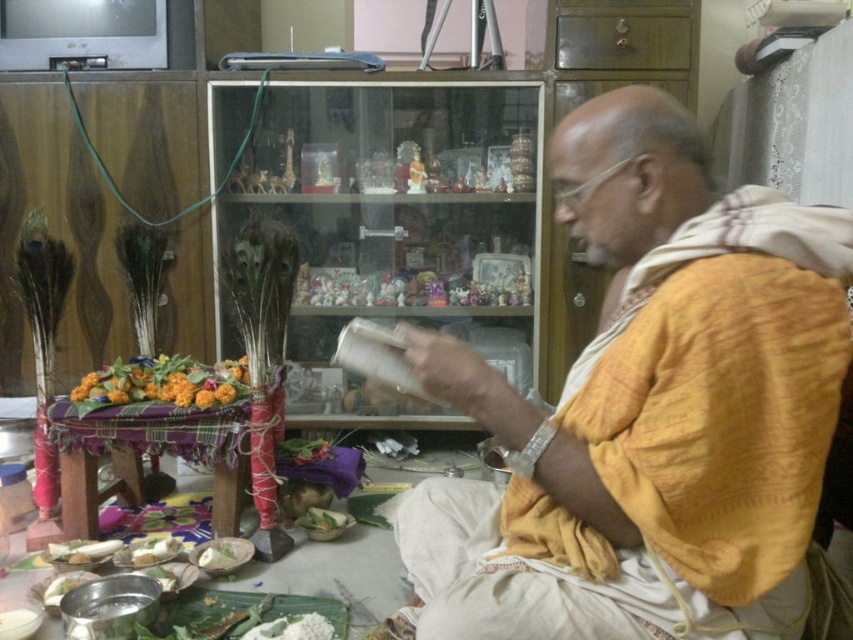
You are a guest at this ceremony and need to place a small offering on the table. The yellow cotton cloth at center and the floral bouquet at center are both on the table. Which item has a larger width?

The yellow cotton cloth at center has a larger width than the floral bouquet at center, as stated in the description.

In the scene shown: You are a guest at this ceremony and want to place a small gift between the floral bouquet at center and the white matte rice at lower center. Based on their sizes, which item should you place your gift closer to?

Since the floral bouquet at center is larger than the white matte rice at lower center, you should place your gift closer to the white matte rice at lower center to maintain balance.

You are a guest at this ceremony and need to place a gift on the table. The host instructed you to place it closer to the floral bouquet at center than to the white matte rice at lower center. Where should you place your gift on the table?

You should place your gift closer to the floral bouquet at center because it is closer to you than the white matte rice at lower center. Since the floral bouquet at center is nearer, placing the gift near it ensures it is closer to the bouquet than the rice.